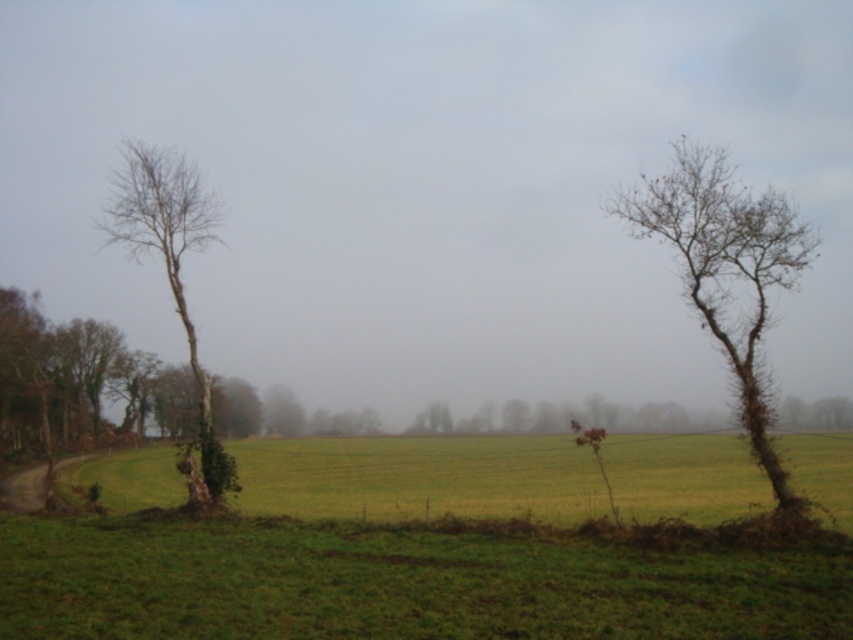
Question: Does bare wood tree at left come behind green matte tree at center?

Choices:
 (A) yes
 (B) no

Answer: (B)

Question: Which of the following is the farthest from the observer?

Choices:
 (A) green matte tree at center
 (B) bare wood tree at right

Answer: (A)

Question: Does bare wood tree at right appear on the left side of bare wood tree at left?

Choices:
 (A) yes
 (B) no

Answer: (B)

Question: Does bare wood tree at left appear under green matte tree at center?

Choices:
 (A) no
 (B) yes

Answer: (A)

Question: Which of the following is the closest to the observer?

Choices:
 (A) (531, 467)
 (B) (270, 392)
 (C) (421, 598)
 (D) (740, 316)

Answer: (C)

Question: Estimate the real-world distances between objects in this image. Which object is closer to the bare wood tree at left?

Choices:
 (A) green matte tree at center
 (B) bare wood tree at right

Answer: (A)